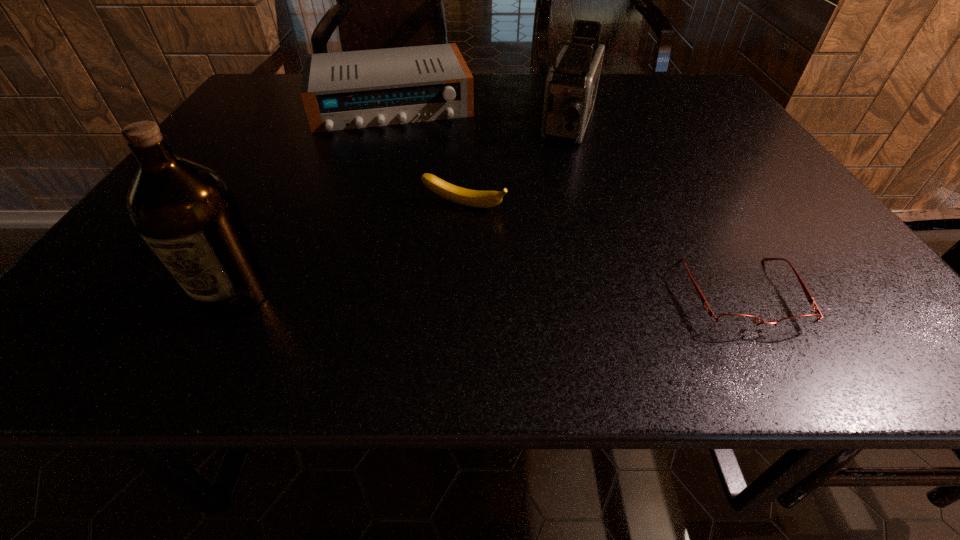
The image size is (960, 540). I want to click on unoccupied position between the tallest object and the shortest object, so (488, 294).

At what (x,y) coordinates should I click in order to perform the action: click on free space between the spectacles and the second shortest object. Please return your answer as a coordinate pair (x, y). Looking at the image, I should click on (602, 251).

I want to click on empty space between the shortest object and the radio receiver, so click(565, 199).

In order to click on vacant area that lies between the radio receiver and the second object from right to left in this screenshot , I will do `click(481, 115)`.

At what (x,y) coordinates should I click in order to perform the action: click on free space between the radio receiver and the banana. Please return your answer as a coordinate pair (x, y). The width and height of the screenshot is (960, 540). Looking at the image, I should click on (427, 156).

You are a GUI agent. You are given a task and a screenshot of the screen. Output one action in this format:
    pyautogui.click(x=<x>, y=<y>)
    Task: Click on the vacant space in between the camcorder and the third nearest object
    
    Given the screenshot: What is the action you would take?
    pyautogui.click(x=517, y=166)

Find the location of `vacant area that lies between the rightmost object and the radio receiver`. vacant area that lies between the rightmost object and the radio receiver is located at coordinates (565, 199).

The width and height of the screenshot is (960, 540). Identify the location of free area in between the tallest object and the fourth tallest object. (349, 251).

At what (x,y) coordinates should I click in order to perform the action: click on vacant point located between the tallest object and the shortest object. Please return your answer as a coordinate pair (x, y). Looking at the image, I should click on (488, 294).

Where is `the fourth closest object to the third tallest object`? the fourth closest object to the third tallest object is located at coordinates (736, 322).